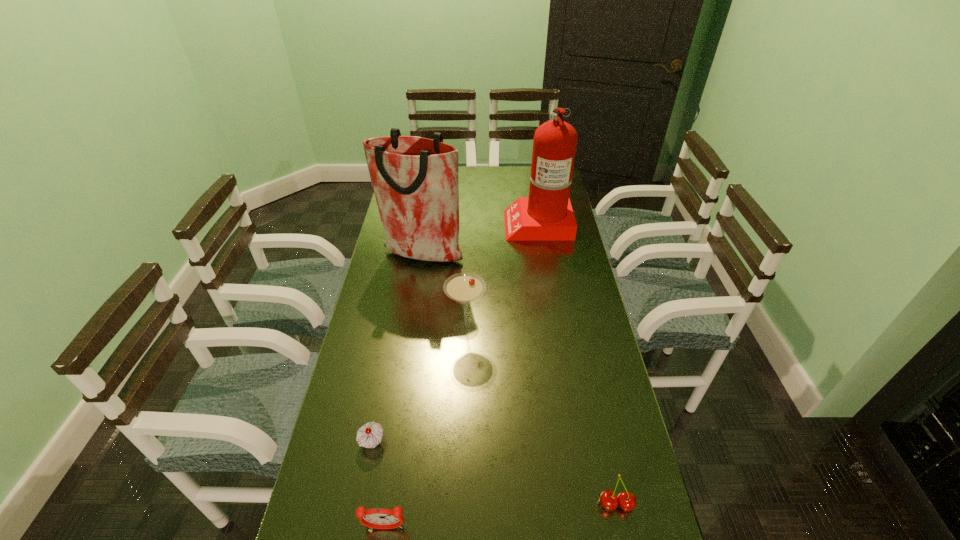
Find the location of a particular element. The image size is (960, 540). fire extinguisher is located at coordinates (546, 215).

Where is `grocery bag`? The image size is (960, 540). grocery bag is located at coordinates (415, 180).

I want to click on martini, so click(x=464, y=288).

You are a GUI agent. You are given a task and a screenshot of the screen. Output one action in this format:
    pyautogui.click(x=<x>, y=<y>)
    Task: Click on the third farthest object
    The width and height of the screenshot is (960, 540).
    Given the screenshot: What is the action you would take?
    pyautogui.click(x=464, y=288)

This screenshot has width=960, height=540. In order to click on cherry in this screenshot , I will do pos(627,501).

In order to click on cupcake in this screenshot , I will do `click(369, 435)`.

You are a GUI agent. You are given a task and a screenshot of the screen. Output one action in this format:
    pyautogui.click(x=<x>, y=<y>)
    Task: Click on the nearest object
    This screenshot has height=540, width=960.
    Given the screenshot: What is the action you would take?
    pyautogui.click(x=378, y=518)

Find the location of a particular element. The width and height of the screenshot is (960, 540). free spot located on the front-facing side of the fire extinguisher is located at coordinates (447, 223).

At what (x,y) coordinates should I click in order to perform the action: click on vacant space positioned on the front-facing side of the fire extinguisher. Please return your answer as a coordinate pair (x, y). The width and height of the screenshot is (960, 540). Looking at the image, I should click on (476, 223).

Identify the location of vacant area situated on the front-facing side of the fire extinguisher. (421, 223).